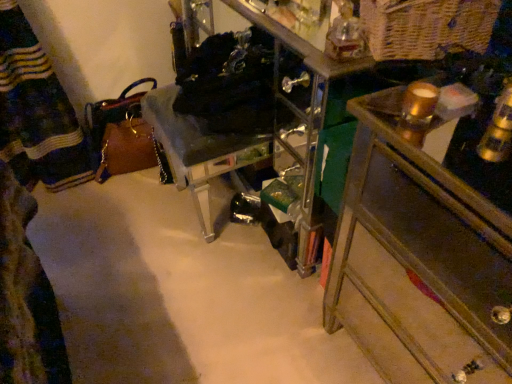
Identify the location of free area below clear acrylic chair at center (from a real-world perspective). (217, 212).